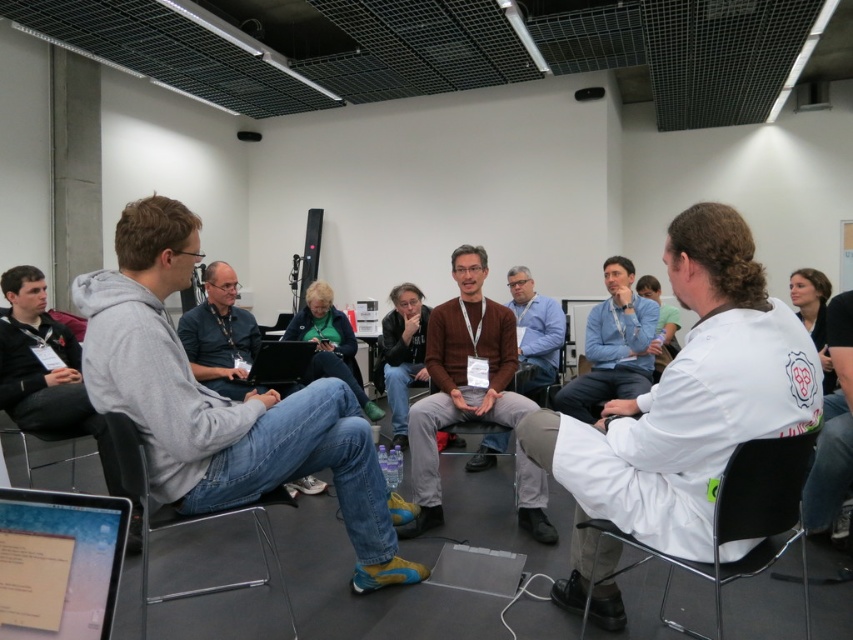
You are a participant in the meeting and you notice the white lab coat at center and the black plastic chair at lower right. Which object is positioned higher in the image?

The white lab coat at center is above the black plastic chair at lower right, so the white lab coat at center is positioned higher in the image.

Based on the photo, you are organizing a space for a workshop and need to place a white lab coat at center and a black plastic chair at lower right next to each other. Given their sizes, which object will require more horizontal space when placed side by side?

The white lab coat at center requires more horizontal space when placed next to the black plastic chair at lower right because its width is larger than the chair.